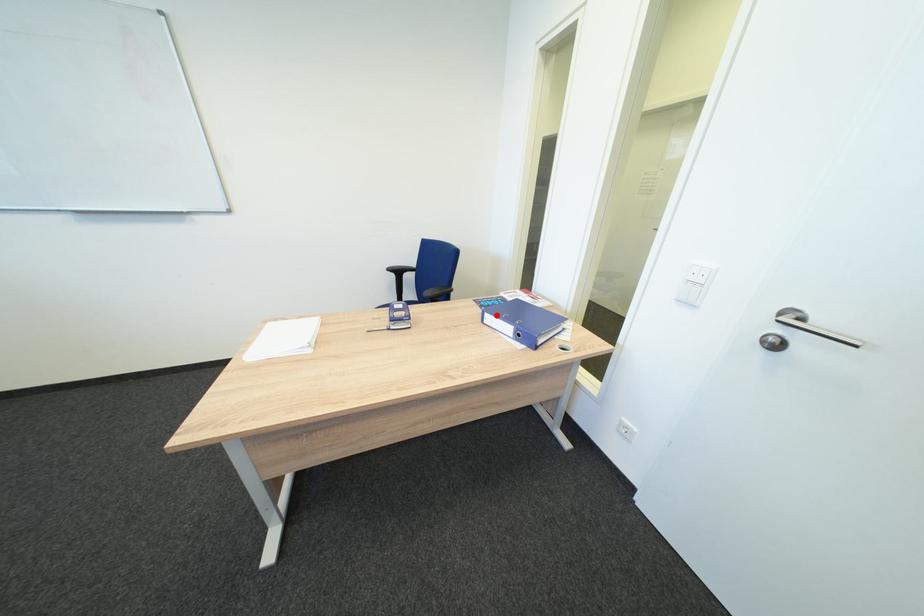
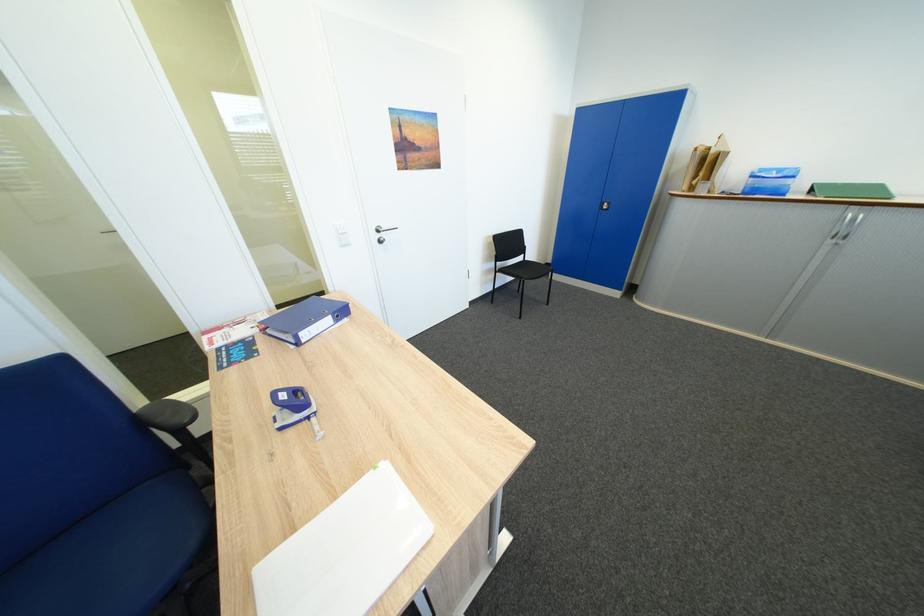
Find the pixel in the second image that matches the highlighted location in the first image.

(310, 334)